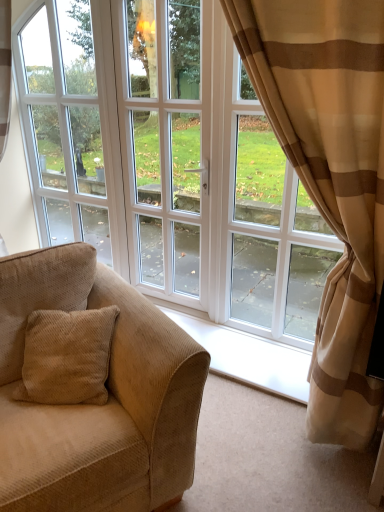
Question: From a real-world perspective, is beige striped curtain at right positioned under white glossy door at center based on gravity?

Choices:
 (A) no
 (B) yes

Answer: (B)

Question: Is beige striped curtain at right shorter than white glossy door at center?

Choices:
 (A) yes
 (B) no

Answer: (A)

Question: Is beige striped curtain at right facing away from white glossy door at center?

Choices:
 (A) no
 (B) yes

Answer: (A)

Question: Is beige striped curtain at right located outside white glossy door at center?

Choices:
 (A) no
 (B) yes

Answer: (B)

Question: Does beige striped curtain at right lie in front of white glossy door at center?

Choices:
 (A) no
 (B) yes

Answer: (B)

Question: Is beige striped curtain at right bigger than white glossy door at center?

Choices:
 (A) yes
 (B) no

Answer: (A)

Question: From a real-world perspective, does white glass window at center sit lower than beige striped curtain at right?

Choices:
 (A) yes
 (B) no

Answer: (B)

Question: From the image's perspective, is white glass window at center under beige striped curtain at right?

Choices:
 (A) no
 (B) yes

Answer: (A)

Question: Could you tell me if white glass window at center is turned towards beige striped curtain at right?

Choices:
 (A) no
 (B) yes

Answer: (A)

Question: Is white glass window at center positioned before beige striped curtain at right?

Choices:
 (A) yes
 (B) no

Answer: (B)

Question: Can you confirm if white glass window at center is positioned to the left of beige striped curtain at right?

Choices:
 (A) yes
 (B) no

Answer: (A)

Question: Can we say white glass window at center lies outside beige striped curtain at right?

Choices:
 (A) no
 (B) yes

Answer: (B)

Question: Does white glossy door at center have a greater height compared to beige corduroy couch at left?

Choices:
 (A) yes
 (B) no

Answer: (A)